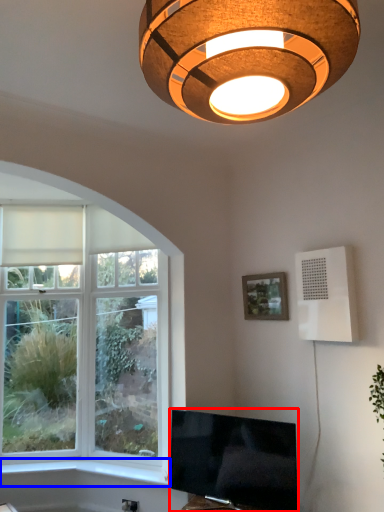
Question: Which object appears closest to the camera in this image, television (highlighted by a red box) or window sill (highlighted by a blue box)?

Choices:
 (A) television
 (B) window sill

Answer: (A)